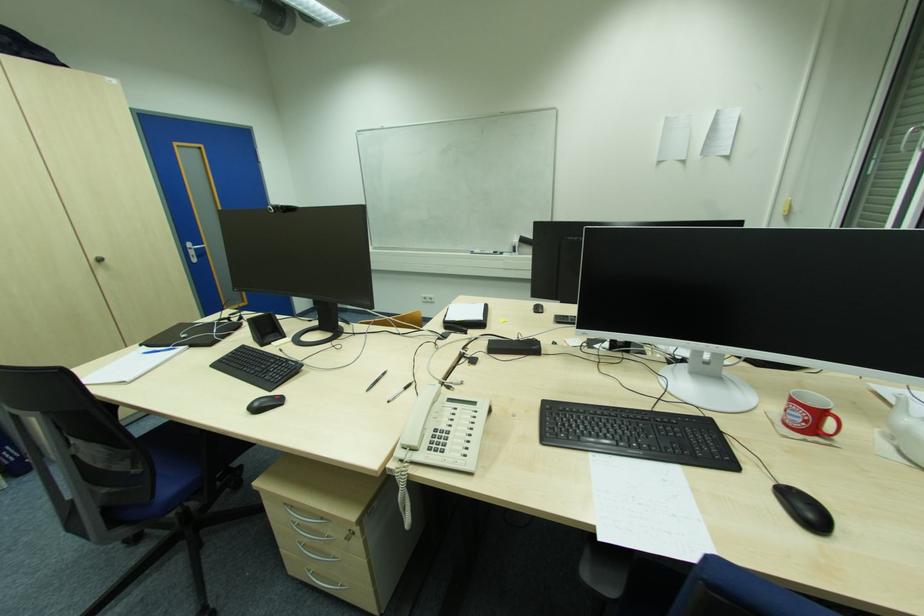
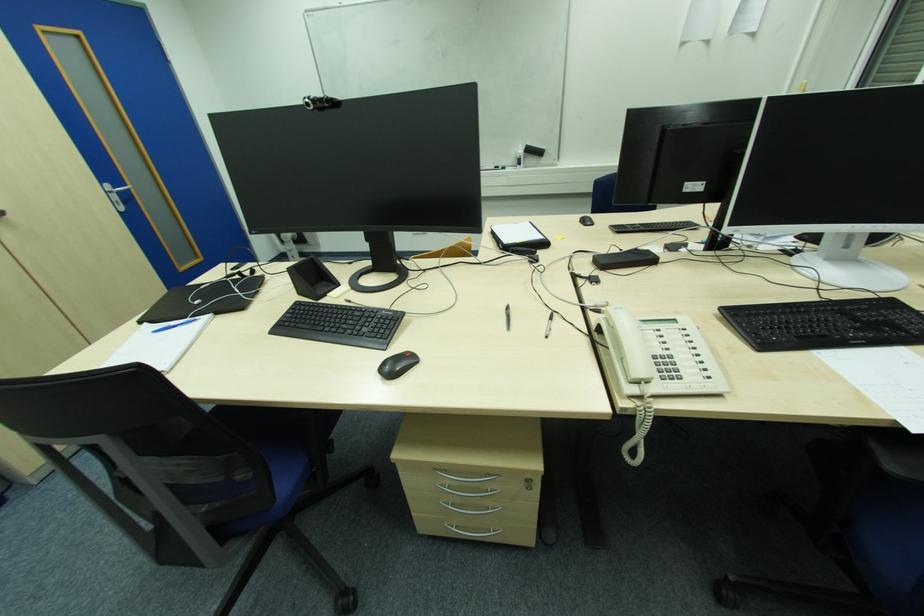
Where in the second image is the point corresponding to point (259, 406) from the first image?

(388, 369)